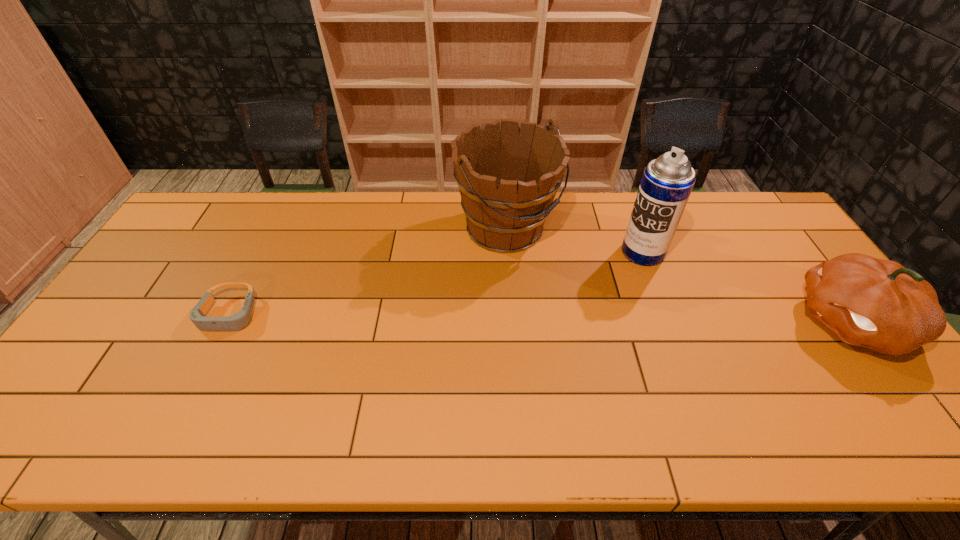
Locate an element on the screen. free point at the left edge is located at coordinates (169, 316).

This screenshot has height=540, width=960. Identify the location of vacant region at the far left corner. (199, 199).

In the image, there is a desktop. Identify the location of free space at the far right corner. Image resolution: width=960 pixels, height=540 pixels. (761, 204).

You are a GUI agent. You are given a task and a screenshot of the screen. Output one action in this format:
    pyautogui.click(x=<x>, y=<y>)
    Task: Click on the vacant space in between the aerosol can and the rightmost object
    The image size is (960, 540).
    Given the screenshot: What is the action you would take?
    pyautogui.click(x=747, y=287)

What are the coordinates of `blank region between the leftmost object and the aerosol can` in the screenshot? It's located at (436, 284).

The image size is (960, 540). In order to click on free area in between the second object from right to left and the rightmost object in this screenshot , I will do `click(747, 287)`.

Where is `free space that is in between the wine bucket and the second shortest object`? The height and width of the screenshot is (540, 960). free space that is in between the wine bucket and the second shortest object is located at coordinates (679, 275).

Identify the location of vacant region between the pumpkin and the leftmost object. This screenshot has height=540, width=960. (540, 318).

At what (x,y) coordinates should I click in order to perform the action: click on vacant area that lies between the second shortest object and the second object from left to right. Please return your answer as a coordinate pair (x, y). The image size is (960, 540). Looking at the image, I should click on (679, 275).

Locate an element on the screen. free space that is in between the aerosol can and the pumpkin is located at coordinates (747, 287).